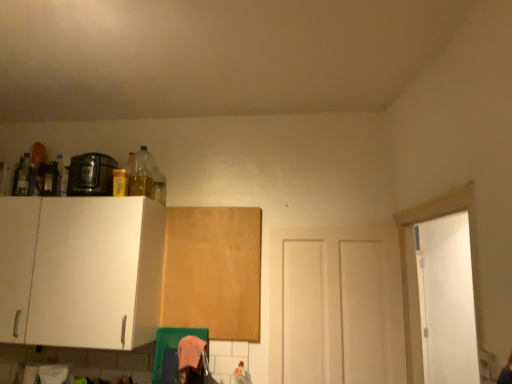
What do you see at coordinates (336, 306) in the screenshot? I see `white matte door at center` at bounding box center [336, 306].

Image resolution: width=512 pixels, height=384 pixels. Find the location of `wooden board at center, positioned as the 1th cabinetry in right-to-left order`. wooden board at center, positioned as the 1th cabinetry in right-to-left order is located at coordinates (213, 271).

In the scene shown: Would you say white matte cabinet at left, the first cabinetry positioned from the left, is to the left or to the right of white matte door at center in the picture?

Clearly, white matte cabinet at left, the first cabinetry positioned from the left, is on the left of white matte door at center in the image.

In terms of size, does white matte cabinet at left, the second cabinetry in the right-to-left sequence, appear bigger or smaller than white matte door at center?

white matte cabinet at left, the second cabinetry in the right-to-left sequence, is bigger than white matte door at center.

In order to click on the 2nd cabinetry counting from the left of the white matte door at center in this screenshot , I will do `click(81, 271)`.

Between white matte cabinet at left, the second cabinetry in the right-to-left sequence, and white matte door at center, which one has larger width?

With larger width is white matte cabinet at left, the second cabinetry in the right-to-left sequence.

Is white matte door at center surrounding shiny black toaster at upper left?

No, shiny black toaster at upper left is not inside white matte door at center.

Is white matte door at center turned away from shiny black toaster at upper left?

white matte door at center does not have its back to shiny black toaster at upper left.

In terms of size, does white matte door at center appear bigger or smaller than shiny black toaster at upper left?

Clearly, white matte door at center is larger in size than shiny black toaster at upper left.

Can you see white matte door at center touching shiny black toaster at upper left?

No.

Does shiny black toaster at upper left turn towards white matte cabinet at left, the second cabinetry in the right-to-left sequence?

No, shiny black toaster at upper left is not oriented towards white matte cabinet at left, the second cabinetry in the right-to-left sequence.

In terms of width, does shiny black toaster at upper left look wider or thinner when compared to white matte cabinet at left, the second cabinetry in the right-to-left sequence?

In the image, shiny black toaster at upper left appears to be more narrow than white matte cabinet at left, the second cabinetry in the right-to-left sequence.

Is there a large distance between shiny black toaster at upper left and white matte cabinet at left, the second cabinetry in the right-to-left sequence?

No, shiny black toaster at upper left is not far from white matte cabinet at left, the second cabinetry in the right-to-left sequence.

Between point (102, 163) and point (48, 293), which one is positioned behind?

The point (102, 163) is farther.

Can wooden board at center, which ranks as the 2th cabinetry in left-to-right order, be found inside white matte door at center?

No, wooden board at center, which ranks as the 2th cabinetry in left-to-right order, is not a part of white matte door at center.

Is white matte door at center positioned far away from wooden board at center, positioned as the 1th cabinetry in right-to-left order?

Actually, white matte door at center and wooden board at center, positioned as the 1th cabinetry in right-to-left order, are a little close together.

How different are the orientations of white matte door at center and wooden board at center, which ranks as the 2th cabinetry in left-to-right order, in degrees?

1.24 degrees.

Between white matte door at center and wooden board at center, positioned as the 1th cabinetry in right-to-left order, which one has more height?

white matte door at center is taller.

From the image's perspective, does white matte cabinet at left, the second cabinetry in the right-to-left sequence, appear lower than wooden board at center, which ranks as the 2th cabinetry in left-to-right order?

No, from the image's perspective, white matte cabinet at left, the second cabinetry in the right-to-left sequence, is not beneath wooden board at center, which ranks as the 2th cabinetry in left-to-right order.

Is white matte cabinet at left, the second cabinetry in the right-to-left sequence, spatially inside wooden board at center, positioned as the 1th cabinetry in right-to-left order, or outside of it?

white matte cabinet at left, the second cabinetry in the right-to-left sequence, is not inside wooden board at center, positioned as the 1th cabinetry in right-to-left order, it's outside.

Is white matte cabinet at left, the first cabinetry positioned from the left, positioned with its back to wooden board at center, which ranks as the 2th cabinetry in left-to-right order?

white matte cabinet at left, the first cabinetry positioned from the left, is not turned away from wooden board at center, which ranks as the 2th cabinetry in left-to-right order.

Considering the sizes of objects white matte cabinet at left, the first cabinetry positioned from the left, and wooden board at center, which ranks as the 2th cabinetry in left-to-right order, in the image provided, who is wider, white matte cabinet at left, the first cabinetry positioned from the left, or wooden board at center, which ranks as the 2th cabinetry in left-to-right order,?

With larger width is white matte cabinet at left, the first cabinetry positioned from the left.

Which of these two, shiny black toaster at upper left or wooden board at center, which ranks as the 2th cabinetry in left-to-right order, is wider?

shiny black toaster at upper left is wider.

Which of these two, shiny black toaster at upper left or wooden board at center, which ranks as the 2th cabinetry in left-to-right order, is bigger?

With larger size is shiny black toaster at upper left.

Is point (112, 163) positioned behind point (206, 246)?

Yes.

Is shiny black toaster at upper left closer to camera compared to wooden board at center, which ranks as the 2th cabinetry in left-to-right order?

Yes, the depth of shiny black toaster at upper left is less than that of wooden board at center, which ranks as the 2th cabinetry in left-to-right order.

From a real-world perspective, is wooden board at center, which ranks as the 2th cabinetry in left-to-right order, physically below white matte door at center?

No, from a real-world perspective, wooden board at center, which ranks as the 2th cabinetry in left-to-right order, is not beneath white matte door at center.

From a real-world perspective, count 2nd cabinetrys upward from the white matte door at center and point to it. Please provide its 2D coordinates.

[(213, 271)]

Looking at this image, which point is more forward, [168,304] or [375,257]?

The point [375,257] is closer to the camera.

In the scene shown: Can you confirm if wooden board at center, positioned as the 1th cabinetry in right-to-left order, is thinner than white matte door at center?

Correct, the width of wooden board at center, positioned as the 1th cabinetry in right-to-left order, is less than that of white matte door at center.

Which cabinetry is the 2nd one when counting from the left side of the white matte door at center? Please provide its 2D coordinates.

[(81, 271)]

This screenshot has height=384, width=512. What are the coordinates of `door on the right of shiny black toaster at upper left` in the screenshot? It's located at (336, 306).

Considering their positions, is white matte cabinet at left, the second cabinetry in the right-to-left sequence, positioned further to white matte door at center than shiny black toaster at upper left?

Among the two, shiny black toaster at upper left is located further to white matte door at center.

Consider the image. From the image, which object appears to be farther from shiny black toaster at upper left, white matte door at center or wooden board at center, which ranks as the 2th cabinetry in left-to-right order?

white matte door at center lies further to shiny black toaster at upper left than the other object.

When comparing their distances from shiny black toaster at upper left, does white matte door at center or white matte cabinet at left, the first cabinetry positioned from the left, seem further?

white matte door at center lies further to shiny black toaster at upper left than the other object.

Which object lies further to the anchor point white matte cabinet at left, the second cabinetry in the right-to-left sequence, shiny black toaster at upper left or wooden board at center, positioned as the 1th cabinetry in right-to-left order?

wooden board at center, positioned as the 1th cabinetry in right-to-left order, is further to white matte cabinet at left, the second cabinetry in the right-to-left sequence.

When comparing their distances from white matte door at center, does wooden board at center, positioned as the 1th cabinetry in right-to-left order, or white matte cabinet at left, the first cabinetry positioned from the left, seem further?

Among the two, white matte cabinet at left, the first cabinetry positioned from the left, is located further to white matte door at center.

From the image, which object appears to be nearer to shiny black toaster at upper left, wooden board at center, positioned as the 1th cabinetry in right-to-left order, or white matte door at center?

The object closer to shiny black toaster at upper left is wooden board at center, positioned as the 1th cabinetry in right-to-left order.

When comparing their distances from wooden board at center, which ranks as the 2th cabinetry in left-to-right order, does shiny black toaster at upper left or white matte door at center seem further?

shiny black toaster at upper left is further to wooden board at center, which ranks as the 2th cabinetry in left-to-right order.

Based on their spatial positions, is white matte door at center or wooden board at center, positioned as the 1th cabinetry in right-to-left order, closer to white matte cabinet at left, the second cabinetry in the right-to-left sequence?

wooden board at center, positioned as the 1th cabinetry in right-to-left order, lies closer to white matte cabinet at left, the second cabinetry in the right-to-left sequence, than the other object.

The height and width of the screenshot is (384, 512). Identify the location of appliance situated between white matte cabinet at left, the first cabinetry positioned from the left, and wooden board at center, which ranks as the 2th cabinetry in left-to-right order, from left to right. (91, 175).

Image resolution: width=512 pixels, height=384 pixels. In order to click on appliance situated between white matte cabinet at left, the first cabinetry positioned from the left, and white matte door at center from left to right in this screenshot , I will do `click(91, 175)`.

Where is `cabinetry between shiny black toaster at upper left and white matte door at center from left to right`? This screenshot has height=384, width=512. cabinetry between shiny black toaster at upper left and white matte door at center from left to right is located at coordinates (213, 271).

Find the location of `cabinetry between white matte cabinet at left, the second cabinetry in the right-to-left sequence, and white matte door at center`. cabinetry between white matte cabinet at left, the second cabinetry in the right-to-left sequence, and white matte door at center is located at coordinates (213, 271).